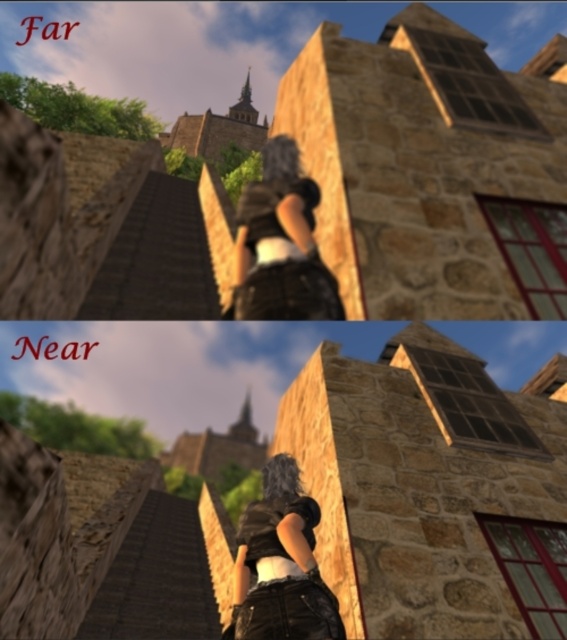
Locate an element on the screen. The width and height of the screenshot is (567, 640). wooden stairs at far is located at coordinates (156, 579).

Does point (205, 573) come farther from viewer compared to point (145, 221)?

No, (205, 573) is in front of (145, 221).

You are a GUI agent. You are given a task and a screenshot of the screen. Output one action in this format:
    pyautogui.click(x=<x>, y=<y>)
    Task: Click on the wooden stairs at far
    
    Given the screenshot: What is the action you would take?
    pyautogui.click(x=156, y=579)

Which is below, matte black shirt at center or matte black hair at center?

Positioned lower is matte black shirt at center.

Is matte black shirt at center below matte black hair at center?

Correct, matte black shirt at center is located below matte black hair at center.

Locate an element on the screen. This screenshot has width=567, height=640. matte black shirt at center is located at coordinates (281, 564).

Who is shorter, wooden stairs at far or matte black shirt at center?

matte black shirt at center

Measure the distance between wooden stairs at far and camera.

The distance of wooden stairs at far from camera is 11.48 feet.

Where is `wooden stairs at far`? wooden stairs at far is located at coordinates pos(156,579).